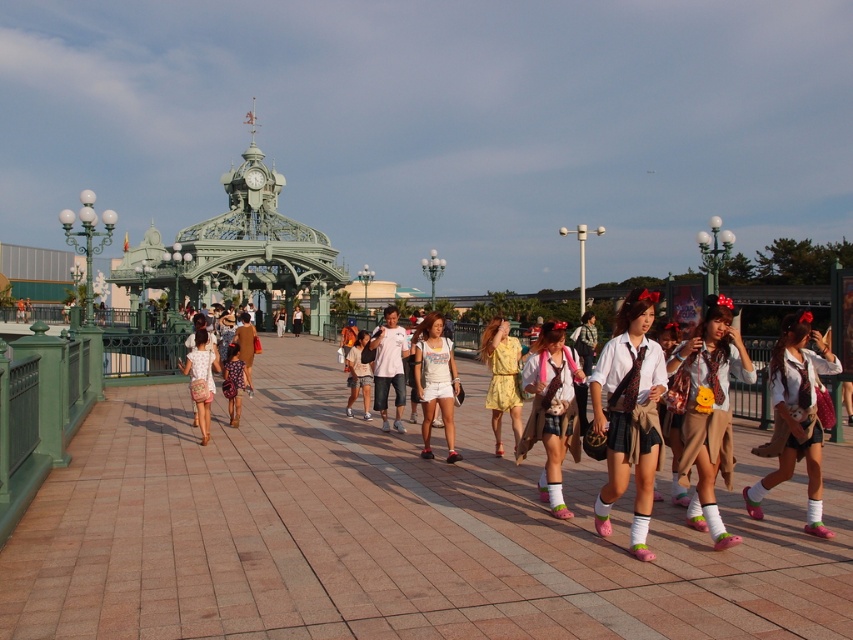
You are standing at the camera position and want to place a small flag at the closest point between point (407, 500) and point (425, 413). Which point should you choose?

Point (407, 500) is closer to the camera than point (425, 413), so you should place the flag at point (407, 500) to be closer to the camera.

Consider the image. You are a photographer standing at the camera position. You want to take a photo of the white cotton dress at center. Is the dress within your camera lens range? The camera has a maximum zoom range of 100 meters.

The white cotton dress at center and camera are 89.69 meters apart from each other. Since the camera has a maximum zoom range of 100 meters, the dress is within the camera lens range.